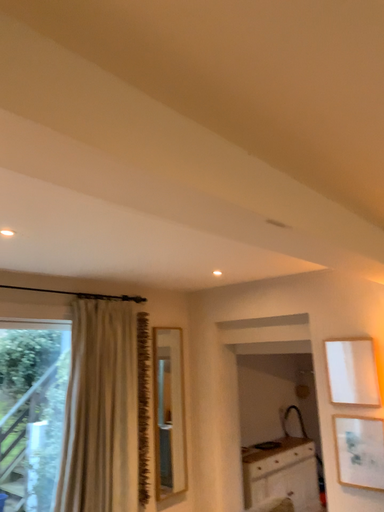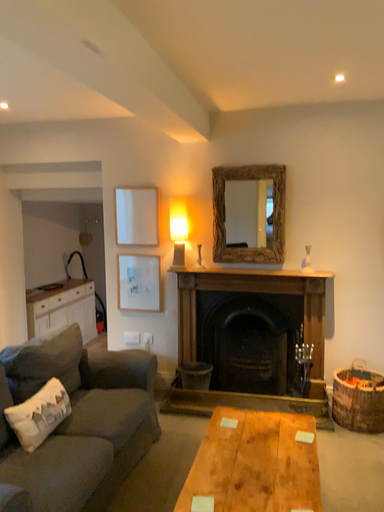
Question: How did the camera likely rotate when shooting the video?

Choices:
 (A) rotated downward
 (B) rotated upward

Answer: (A)